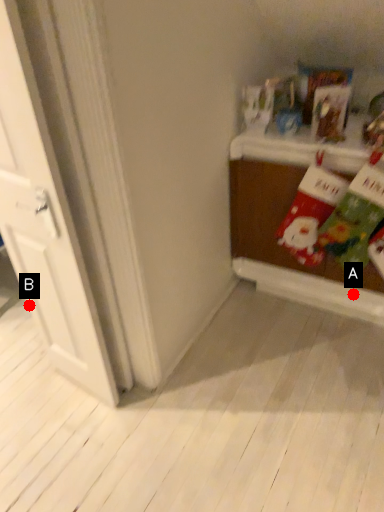
Question: Two points are circled on the image, labeled by A and B beside each circle. Which of the following is the farthest from the observer?

Choices:
 (A) A is further
 (B) B is further

Answer: (A)